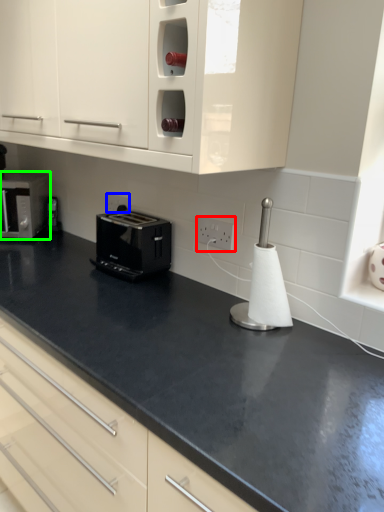
Question: Which object is the farthest from electric outlet (highlighted by a red box)? Choose among these: electric outlet (highlighted by a blue box) or home appliance (highlighted by a green box).

Choices:
 (A) electric outlet
 (B) home appliance

Answer: (B)